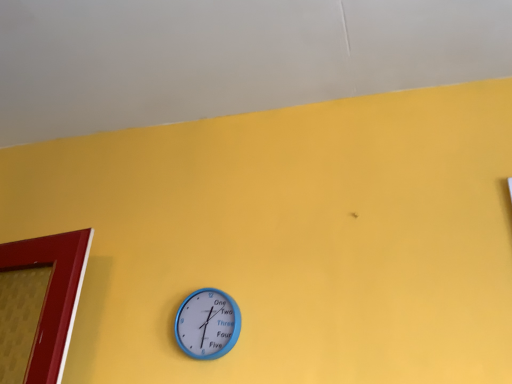
Question: Can you confirm if yellow matte wall at upper center is positioned to the right of blue plastic wall clock at center?

Choices:
 (A) yes
 (B) no

Answer: (B)

Question: Is yellow matte wall at upper center not inside blue plastic wall clock at center?

Choices:
 (A) no
 (B) yes

Answer: (B)

Question: From the image's perspective, is yellow matte wall at upper center above blue plastic wall clock at center?

Choices:
 (A) no
 (B) yes

Answer: (B)

Question: Can you confirm if yellow matte wall at upper center is thinner than blue plastic wall clock at center?

Choices:
 (A) yes
 (B) no

Answer: (B)

Question: From a real-world perspective, is yellow matte wall at upper center on top of blue plastic wall clock at center?

Choices:
 (A) no
 (B) yes

Answer: (B)

Question: Could you tell me if yellow matte wall at upper center is facing blue plastic wall clock at center?

Choices:
 (A) yes
 (B) no

Answer: (B)

Question: Is blue plastic wall clock at center further to camera compared to yellow matte wall at upper center?

Choices:
 (A) no
 (B) yes

Answer: (B)

Question: Is yellow matte wall at upper center surrounded by blue plastic wall clock at center?

Choices:
 (A) yes
 (B) no

Answer: (B)

Question: Does blue plastic wall clock at center have a greater height compared to yellow matte wall at upper center?

Choices:
 (A) yes
 (B) no

Answer: (A)

Question: Is blue plastic wall clock at center not close to yellow matte wall at upper center?

Choices:
 (A) yes
 (B) no

Answer: (B)

Question: Is blue plastic wall clock at center closer to the viewer compared to yellow matte wall at upper center?

Choices:
 (A) no
 (B) yes

Answer: (A)

Question: Are blue plastic wall clock at center and yellow matte wall at upper center making contact?

Choices:
 (A) no
 (B) yes

Answer: (A)

Question: Is blue plastic wall clock at center situated inside yellow matte wall at upper center or outside?

Choices:
 (A) inside
 (B) outside

Answer: (B)